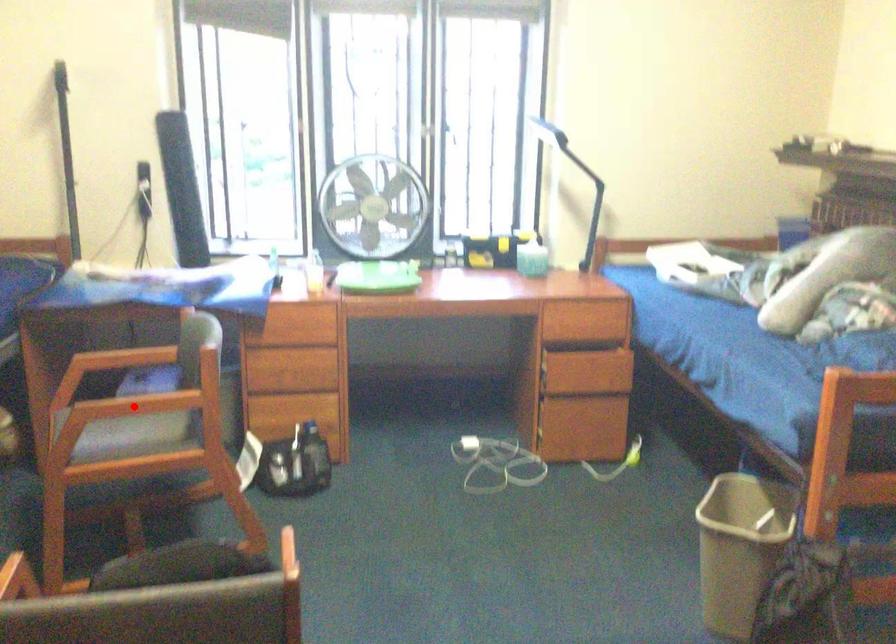
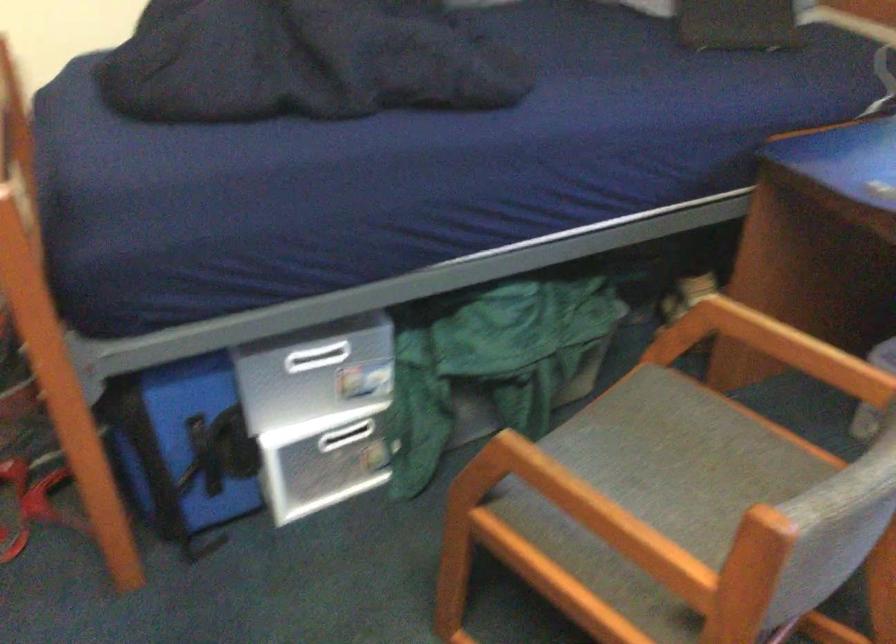
Question: A red point is marked in image1. In image2, is the corresponding 3D point closer to the camera or farther? Reply with the corresponding letter.

Choices:
 (A) The corresponding 3D point is closer.
 (B) The corresponding 3D point is farther.

Answer: (A)